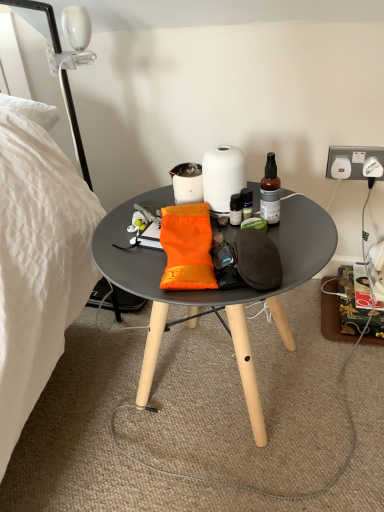
Identify the location of vacant area to the right of translucent glass bottle at upper right. The height and width of the screenshot is (512, 384). (305, 221).